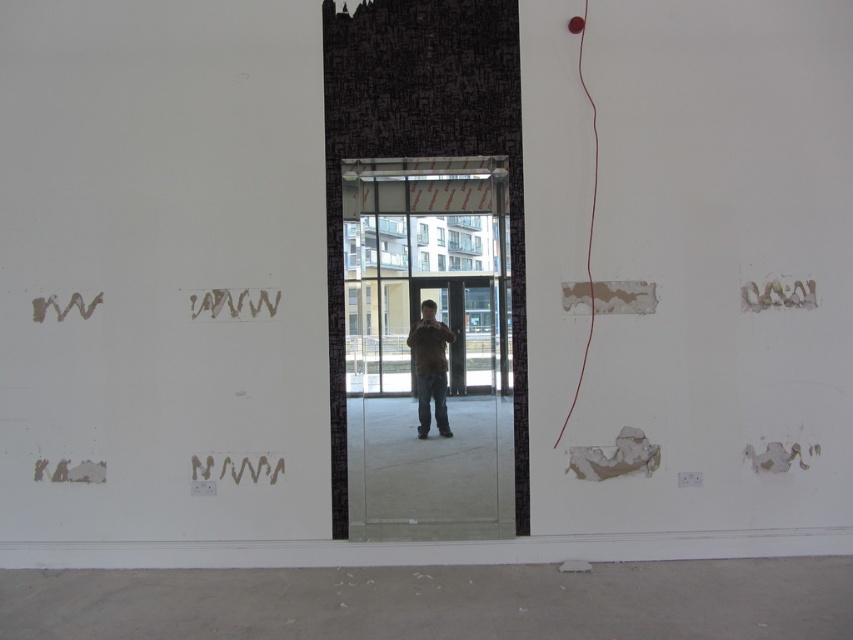
You are a delivery person trying to enter the construction site through the transparent glass door at center. The black matte text at center has a warning that requires you to stay at least 40 inches away from it. Can you safely pass through the door without violating the distance requirement?

The transparent glass door at center is only 38.84 inches from the black matte text at center. Since the required distance is 40 inches, passing through the door would bring you too close to the text, violating the safety requirement. You should find an alternative route or inform the site manager about the issue.

You are a delivery person trying to enter the room through the transparent glass door at center. However, there is a black matte text at center blocking your path. Can you pass through the door without moving the text?

The transparent glass door at center might be wider than black matte text at center, so it is possible that the door is wide enough to allow passage while avoiding the text. However, since the text is at the center, you might need to adjust your path slightly to go around it.

You are an interior designer assessing the space. You notice the red matte string at right and the black matte text at center. Which object is positioned higher up in the room?

The red matte string at right is much taller than the black matte text at center, so it is positioned higher up in the room.